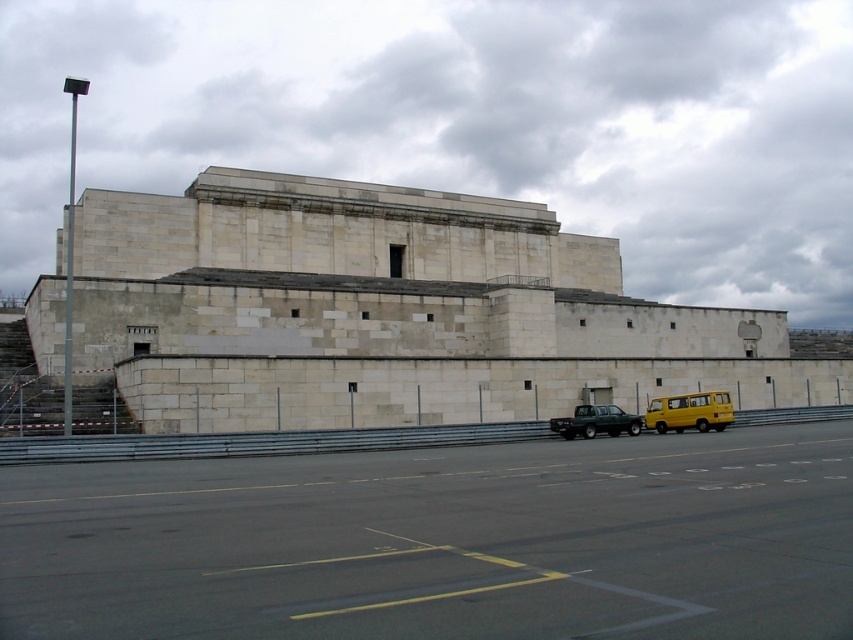
You are a delivery driver approaching the building and need to park your vehicle. You see the yellow matte van at lower right and the matte black truck at center. Which vehicle is closer to you as you approach the building?

The yellow matte van at lower right is closer to you because it is positioned further to the viewer than the matte black truck at center, meaning it is nearer in your line of sight as you approach the building.

You are a delivery driver who needs to park your 3.5 meter long vehicle in the parking area in front of the building. You see the yellow matte van at lower right and the matte black truck at center. Which parking space between these two vehicles would be suitable for your vehicle?

The yellow matte van at lower right is shorter than the matte black truck at center. Since your vehicle is 3.5 meters long, the parking space between the yellow matte van at lower right and the matte black truck at center would be suitable if it can accommodate a vehicle of that length. However, the exact suitability depends on the available space between them, which isn